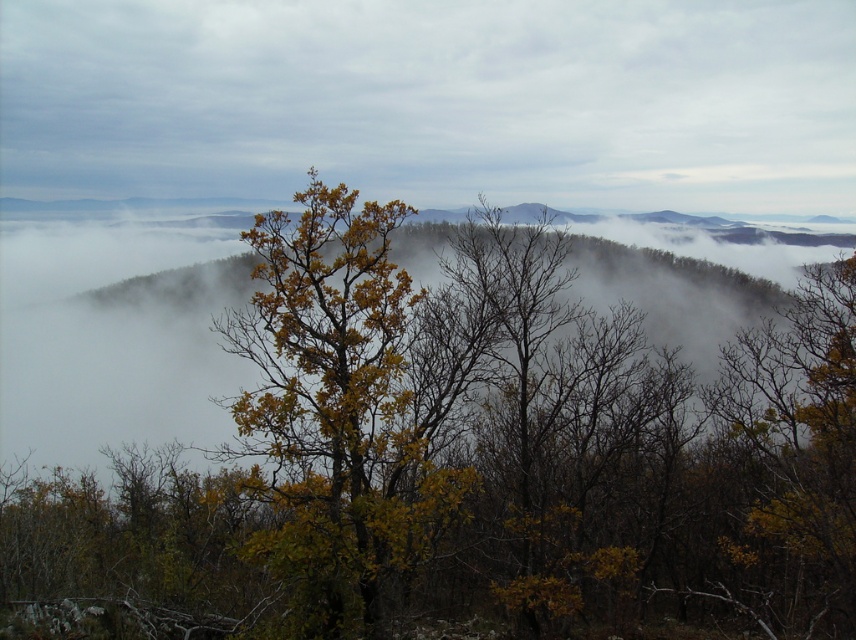
From the picture: You are standing in the valley looking at the landscape. There is a point marked at coordinates [467,458]. What color are the leaves at that point?

The point at [467,458] corresponds to yellowgreen leaves at center, so the leaves there are yellowgreen in color.